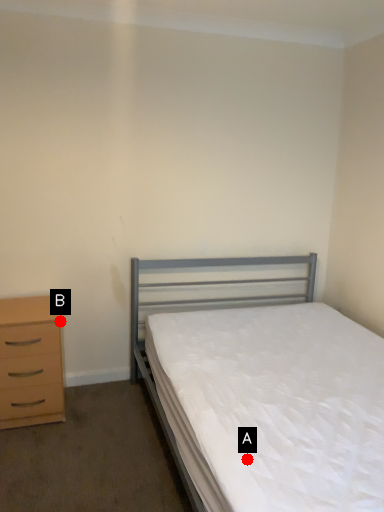
Question: Two points are circled on the image, labeled by A and B beside each circle. Which point is farther from the camera taking this photo?

Choices:
 (A) A is further
 (B) B is further

Answer: (B)